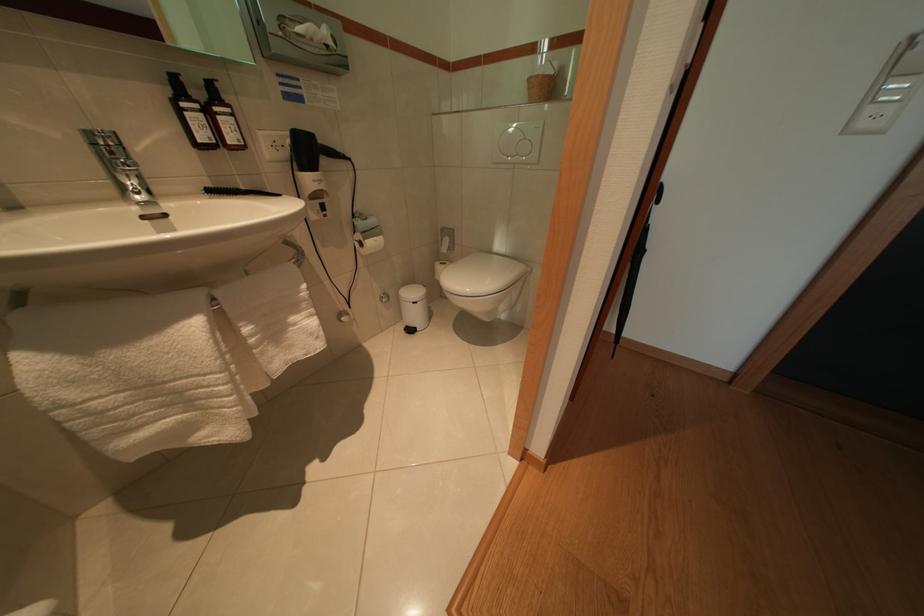
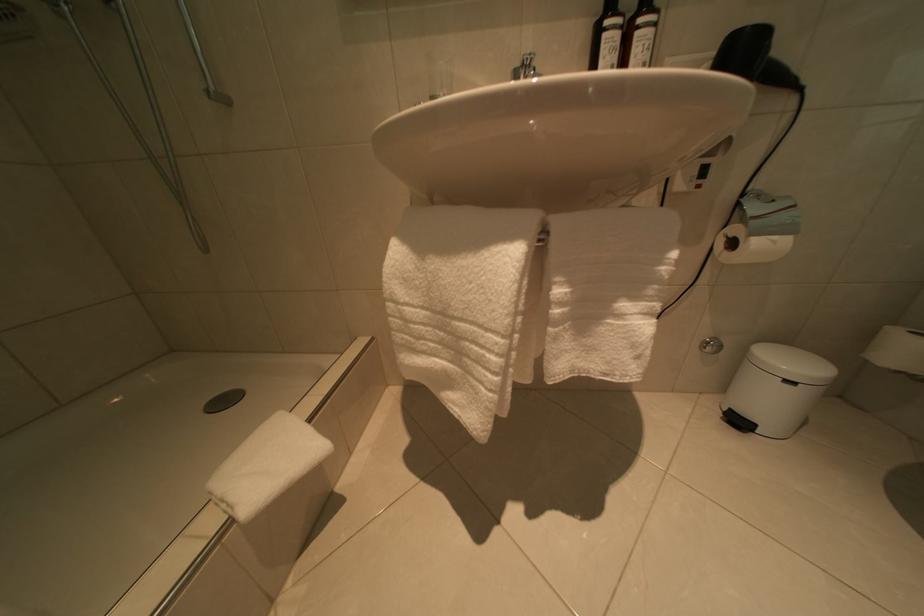
Find the pixel in the second image that matches [419,337] in the first image.

(746, 428)